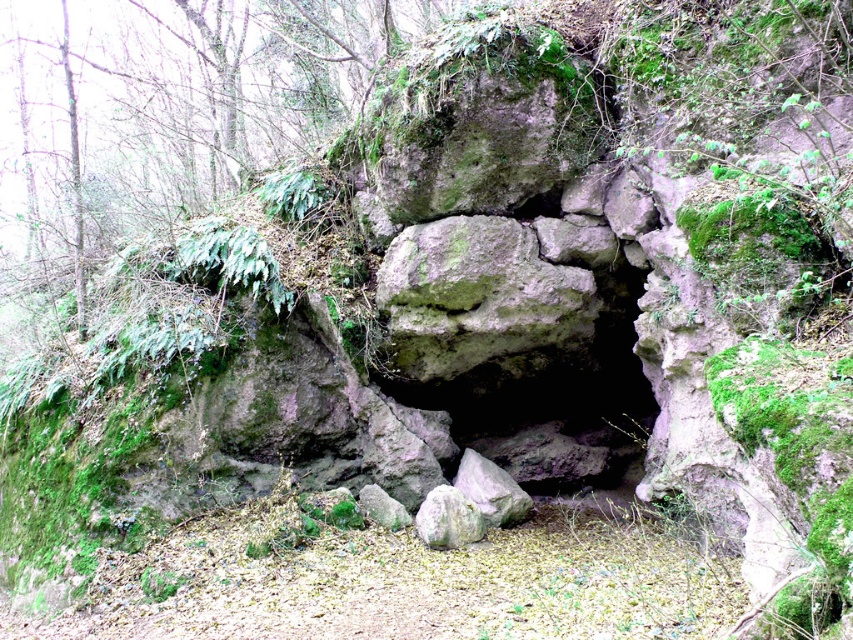
Is the position of green mossy rock at center more distant than that of smooth gray rock at center?

No, green mossy rock at center is in front of smooth gray rock at center.

Measure the distance between point (x=453, y=285) and camera.

Point (x=453, y=285) is 15.29 feet away from camera.

What are the coordinates of `green mossy rock at center` in the screenshot? It's located at (477, 298).

Is gray rough rock at center behind smooth gray rock at center?

That is False.

Which of these two, gray rough rock at center or smooth gray rock at center, stands taller?

gray rough rock at center is taller.

Does point (450, 493) come in front of point (386, 502)?

That is True.

The image size is (853, 640). In order to click on gray rough rock at center in this screenshot , I will do `click(448, 518)`.

Between point (410, 305) and point (431, 545), which one is positioned behind?

Point (410, 305)

Does green mossy rock at center have a lesser width compared to gray rough rock at center?

→ In fact, green mossy rock at center might be wider than gray rough rock at center.

Identify the location of green mossy rock at center. (477, 298).